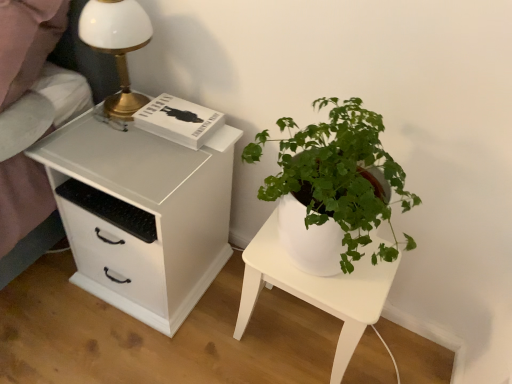
Image resolution: width=512 pixels, height=384 pixels. What are the coordinates of `vacant area that is in front of white matte chest of drawers at left` in the screenshot? It's located at (121, 350).